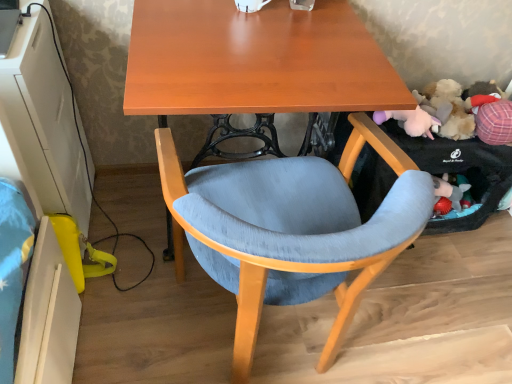
Question: Does white glossy computer desk at lower left have a smaller size compared to matte wood desk at center?

Choices:
 (A) yes
 (B) no

Answer: (A)

Question: Does white glossy computer desk at lower left lie behind matte wood desk at center?

Choices:
 (A) no
 (B) yes

Answer: (B)

Question: Is white glossy computer desk at lower left beside matte wood desk at center?

Choices:
 (A) no
 (B) yes

Answer: (A)

Question: From a real-world perspective, is white glossy computer desk at lower left positioned under matte wood desk at center based on gravity?

Choices:
 (A) yes
 (B) no

Answer: (A)

Question: Is white glossy computer desk at lower left oriented towards matte wood desk at center?

Choices:
 (A) no
 (B) yes

Answer: (B)

Question: Is there a large distance between white glossy computer desk at lower left and matte wood desk at center?

Choices:
 (A) no
 (B) yes

Answer: (A)

Question: From a real-world perspective, does textured fabric chair at center sit lower than matte wood desk at center?

Choices:
 (A) yes
 (B) no

Answer: (A)

Question: From the image's perspective, is textured fabric chair at center above matte wood desk at center?

Choices:
 (A) yes
 (B) no

Answer: (B)

Question: Does textured fabric chair at center have a lesser width compared to matte wood desk at center?

Choices:
 (A) no
 (B) yes

Answer: (B)

Question: Is textured fabric chair at center smaller than matte wood desk at center?

Choices:
 (A) no
 (B) yes

Answer: (B)

Question: Is textured fabric chair at center positioned in front of matte wood desk at center?

Choices:
 (A) no
 (B) yes

Answer: (B)

Question: Are textured fabric chair at center and matte wood desk at center far apart?

Choices:
 (A) no
 (B) yes

Answer: (A)

Question: Could you tell me if fluffy plush toy at right is facing textured fabric chair at center?

Choices:
 (A) no
 (B) yes

Answer: (A)